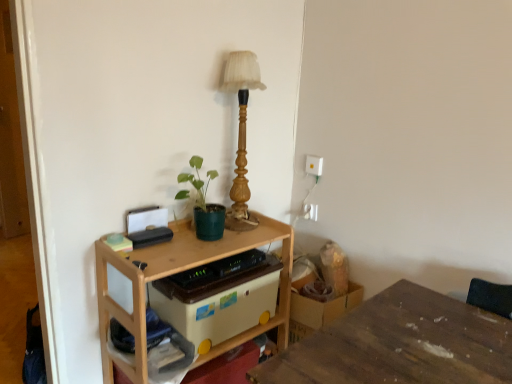
The height and width of the screenshot is (384, 512). I want to click on vacant space in front of wooden table lamp at upper center, so click(245, 239).